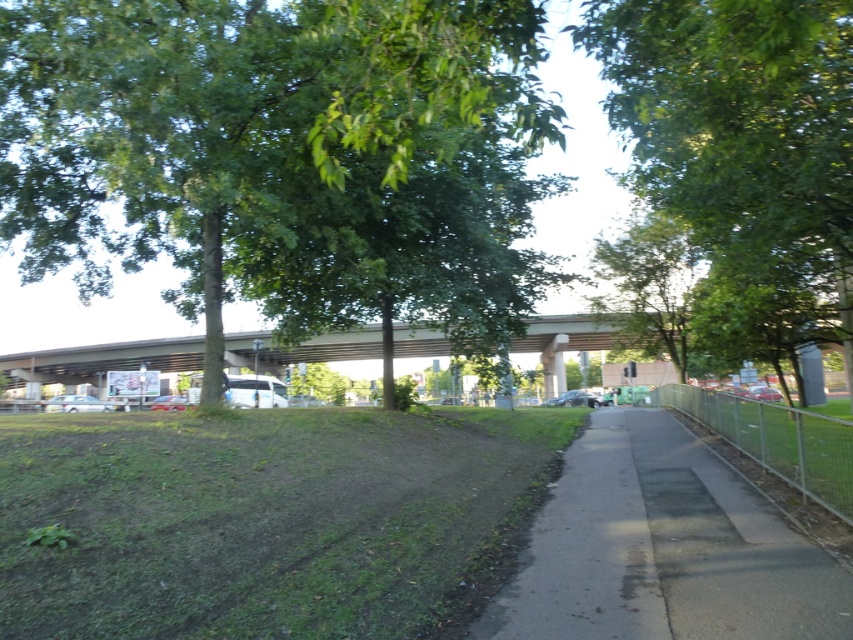
You are standing at the point marked as point (265, 145) in the image. Looking ahead, you see a green leafy tree at upper left. Which direction should you walk to avoid the tree and stay on the path?

The green leafy tree at upper left is located at point (265, 145). To avoid the tree and stay on the path, you should walk towards the right as the path curves gently to the right.

You are a pedestrian standing on the paved pathway in the image. You notice a green leafy tree at center and a satin silver sedan at center. Which object is larger in size?

The green leafy tree at center is bigger than the satin silver sedan at center, so the green leafy tree at center is larger in size.

You are driving a satin silver sedan at center and want to park it next to the matte silver van at lower left. Given their sizes, can you safely park the sedan without overlapping the van?

The satin silver sedan at center is smaller than the matte silver van at lower left, so you can safely park the sedan next to the van without overlapping since it requires less space.